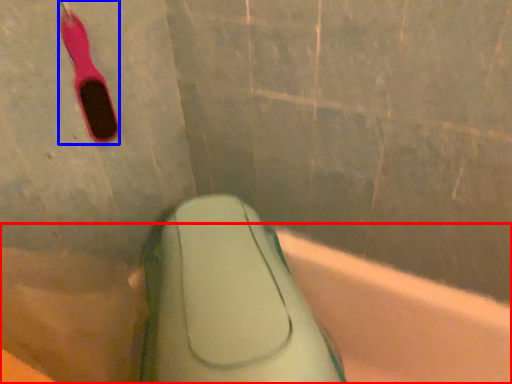
Question: Which object appears closest to the camera in this image, bath (highlighted by a red box) or toothbrush (highlighted by a blue box)?

Choices:
 (A) bath
 (B) toothbrush

Answer: (A)